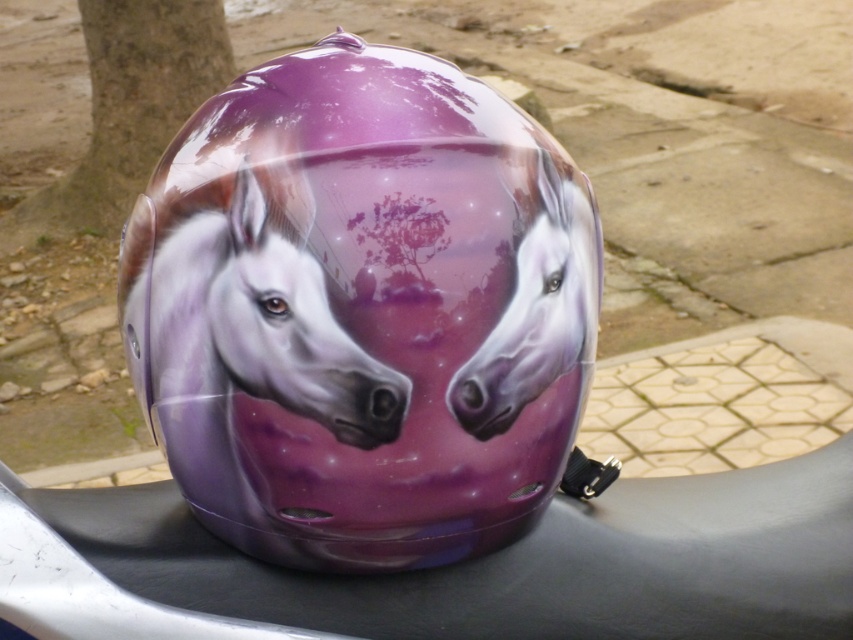
Question: Is glossy purple helmet at center thinner than glossy purple horse at center?

Choices:
 (A) yes
 (B) no

Answer: (B)

Question: Which object is farther from the camera taking this photo?

Choices:
 (A) glossy purple horse at center
 (B) glossy purple helmet at center

Answer: (A)

Question: Which point appears closest to the camera in this image?

Choices:
 (A) (392, 49)
 (B) (369, 371)

Answer: (B)

Question: Does glossy purple helmet at center appear under glossy purple horse at center?

Choices:
 (A) yes
 (B) no

Answer: (B)

Question: Does glossy purple helmet at center have a lesser width compared to glossy purple horse at center?

Choices:
 (A) yes
 (B) no

Answer: (B)

Question: Which object appears closest to the camera in this image?

Choices:
 (A) glossy purple horse at center
 (B) glossy purple helmet at center

Answer: (B)